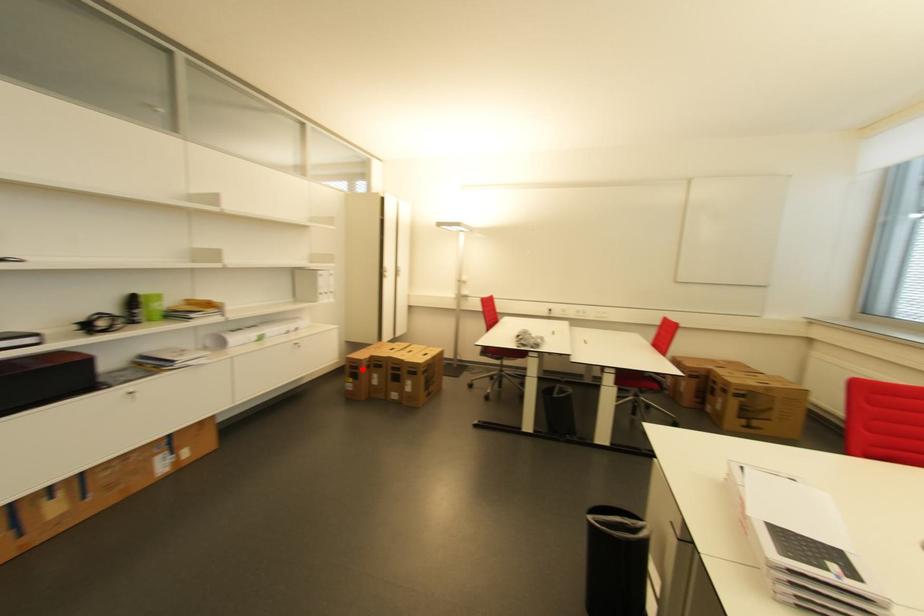
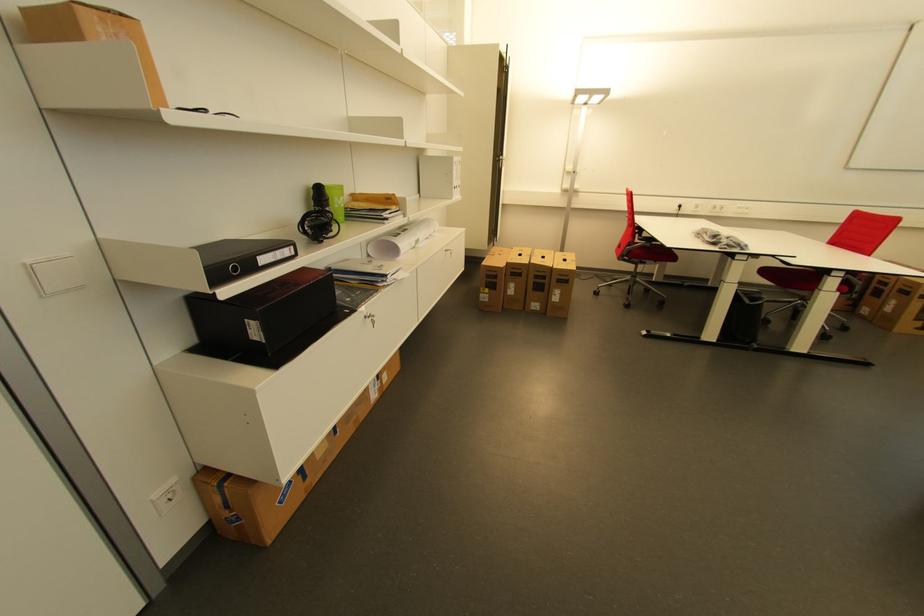
Question: I am providing you with two images of the same scene from different viewpoints. In image1, a red point is highlighted. Considering the same 3D point in image2, which of the following is correct?

Choices:
 (A) It is closer
 (B) It is farther

Answer: (A)